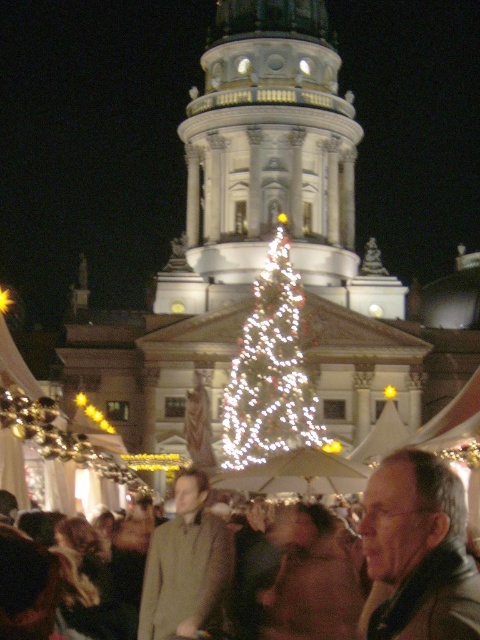
You are standing at point (412, 508) and want to walk to the Christmas tree. Is there an unobstructed path from your current position to the Christmas tree without passing through point (385, 572)?

Point (385, 572) is behind point (412, 508), so you can walk towards the Christmas tree without passing through point (385, 572).

You are at the Christmas market and see two coats hanging on adjacent hooks. The brown wool coat at lower center and the green wool coat at center. Which coat takes up more space?

The brown wool coat at lower center is bigger than the green wool coat at center, so it takes up more space.